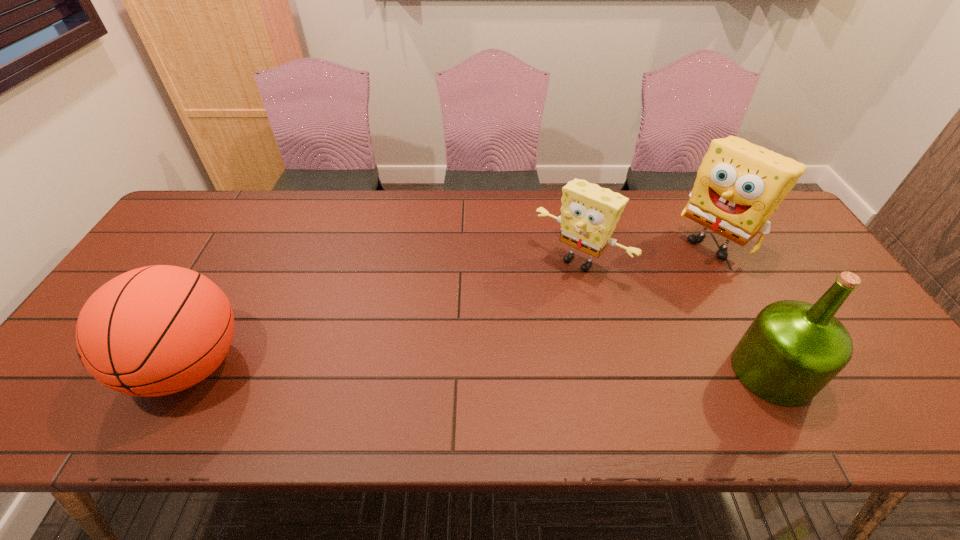
Locate an element on the screen. vacant area between the taller sponge and the left sponge is located at coordinates click(647, 251).

I want to click on vacant area between the taller sponge and the leftmost object, so click(x=452, y=303).

Identify the location of free space between the olive oil and the right sponge. (743, 307).

What are the coordinates of `empty space that is in between the second object from left to right and the olive oil` in the screenshot? It's located at (676, 316).

I want to click on unoccupied area between the taller sponge and the olive oil, so click(743, 307).

Where is `object that ranks as the second closest to the olive oil`? The height and width of the screenshot is (540, 960). object that ranks as the second closest to the olive oil is located at coordinates (589, 214).

Select which object is the third closest to the olive oil. Please provide its 2D coordinates. Your answer should be formatted as a tuple, i.e. [(x, y)], where the tuple contains the x and y coordinates of a point satisfying the conditions above.

[(156, 330)]

At what (x,y) coordinates should I click in order to perform the action: click on blank space that satisfies the following two spatial constraints: 1. on the back side of the right sponge; 2. on the right side of the shorter sponge. Please return your answer as a coordinate pair (x, y). This screenshot has width=960, height=540. Looking at the image, I should click on tap(575, 242).

Image resolution: width=960 pixels, height=540 pixels. In order to click on free space that satisfies the following two spatial constraints: 1. on the front side of the olive oil; 2. on the left side of the left sponge in this screenshot , I will do `click(605, 372)`.